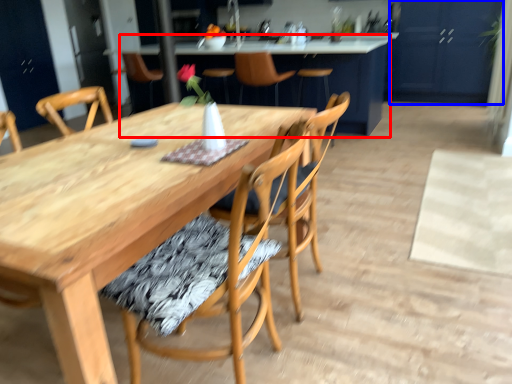
Question: Among these objects, which one is farthest to the camera, table (highlighted by a red box) or cabinetry (highlighted by a blue box)?

Choices:
 (A) table
 (B) cabinetry

Answer: (B)